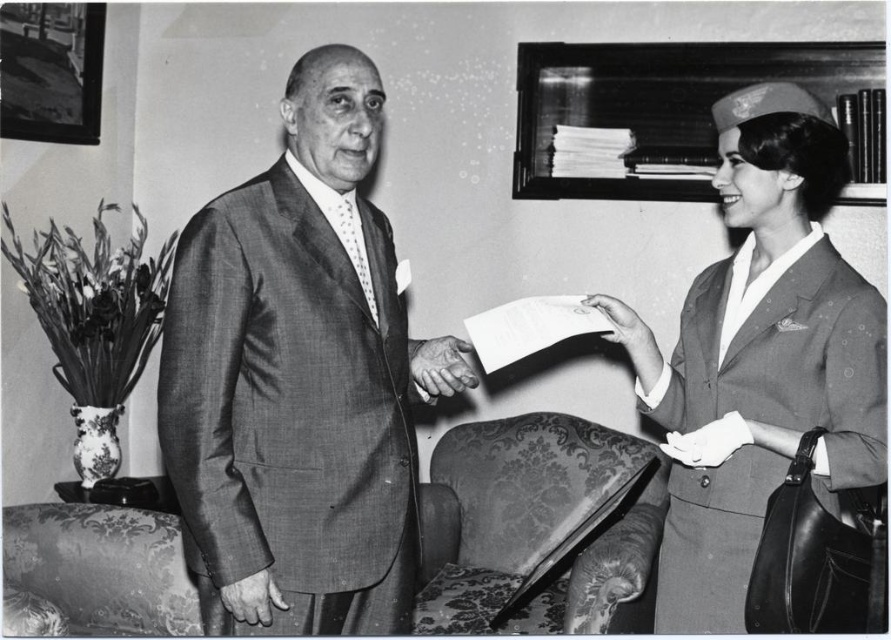
Is smooth wool suit at center bigger than damask-patterned fabric armchair at lower center?

No.

Identify the location of smooth wool suit at center. (295, 376).

Between point (182, 444) and point (517, 532), which one is positioned in front?

Point (182, 444) is in front.

I want to click on smooth wool suit at center, so click(295, 376).

Is smooth fabric uniform at right to the left of smooth skin hand at center from the viewer's perspective?

Incorrect, smooth fabric uniform at right is not on the left side of smooth skin hand at center.

Looking at this image, which is below, smooth fabric uniform at right or smooth skin hand at center?

smooth fabric uniform at right is below.

Who is more distant from viewer, [707,310] or [436,353]?

The point [436,353] is more distant.

The image size is (891, 640). I want to click on smooth fabric uniform at right, so click(761, 355).

Is smooth wool suit at center thinner than smooth fabric uniform at right?

Correct, smooth wool suit at center's width is less than smooth fabric uniform at right's.

Between point (282, 468) and point (695, 573), which one is positioned behind?

The point (695, 573) is behind.

Find the location of a particular element. smooth wool suit at center is located at coordinates (295, 376).